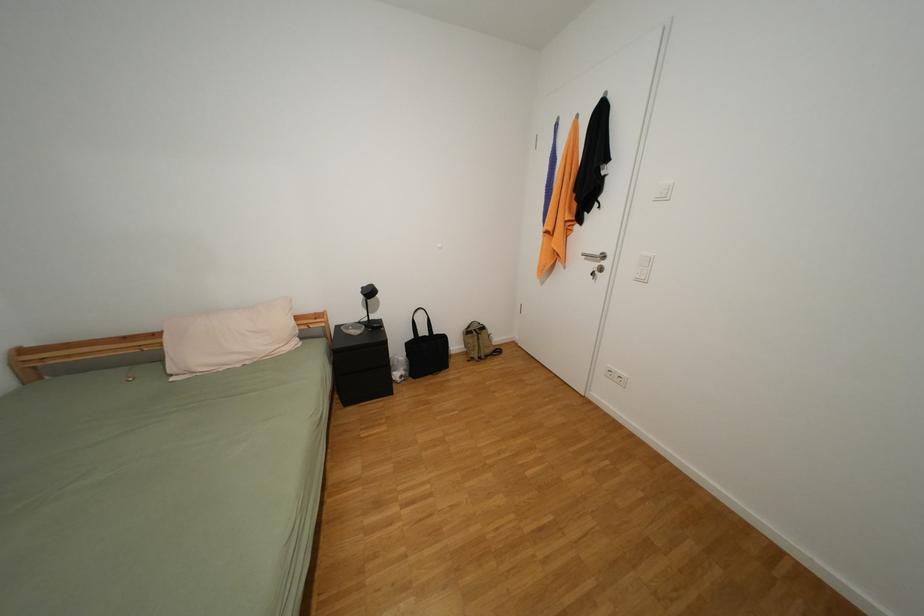
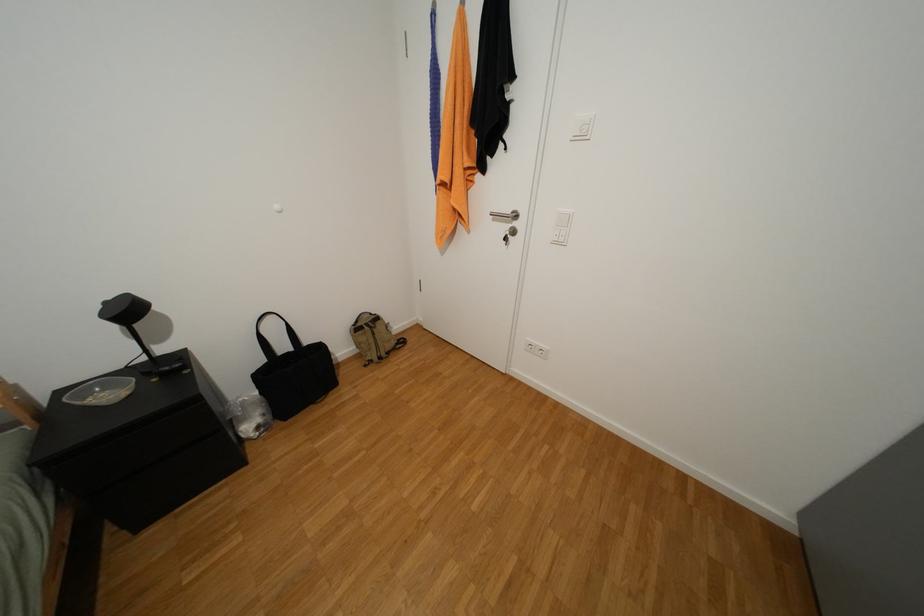
Question: The images are taken continuously from a first-person perspective. In which direction are you moving?

Choices:
 (A) Left
 (B) Right
 (C) Forward
 (D) Backward

Answer: (C)